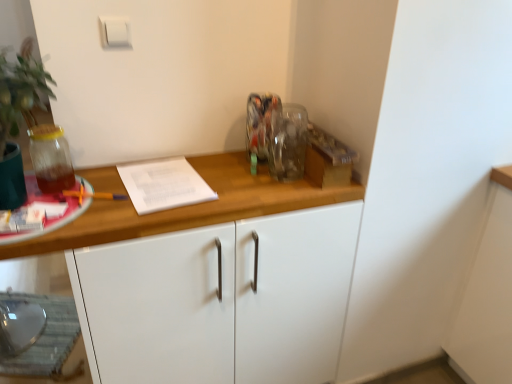
Where is `white plastic light switch at upper center`? The width and height of the screenshot is (512, 384). white plastic light switch at upper center is located at coordinates (115, 32).

Identify the location of white plastic light switch at upper center. [x=115, y=32].

Which is nearer, (125,22) or (54,160)?

The point (54,160) is in front.

Is white plastic light switch at upper center wider than translucent glass jar at left?

In fact, white plastic light switch at upper center might be narrower than translucent glass jar at left.

How different are the orientations of white plastic light switch at upper center and translucent glass jar at left in degrees?

white plastic light switch at upper center and translucent glass jar at left are facing 3.45 degrees away from each other.

Is translucent glass jar at left taller than white plastic light switch at upper center?

Yes, translucent glass jar at left is taller than white plastic light switch at upper center.

Which object is wider, translucent glass jar at left or white plastic light switch at upper center?

translucent glass jar at left is wider.

Choose the correct answer: Is translucent glass jar at left inside white plastic light switch at upper center or outside it?

translucent glass jar at left is located beyond the bounds of white plastic light switch at upper center.

Is translucent glass jar at left facing away from white plastic light switch at upper center?

No, white plastic light switch at upper center is not at the back of translucent glass jar at left.

Is the surface of white plastic light switch at upper center in direct contact with white matte cabinet at center?

They are not placed beside each other.

Is white plastic light switch at upper center positioned with its back to white matte cabinet at center?

No, white plastic light switch at upper center is not facing away from white matte cabinet at center.

How different are the orientations of white plastic light switch at upper center and white matte cabinet at center in degrees?

white plastic light switch at upper center and white matte cabinet at center are facing 0.531 degrees away from each other.

From a real-world perspective, who is located higher, white plastic light switch at upper center or white matte cabinet at center?

In real-world perspective, white plastic light switch at upper center is above.

Which object is more forward, translucent glass jar at left or white matte cabinet at center?

white matte cabinet at center is more forward.

From a real-world perspective, who is located lower, translucent glass jar at left or white matte cabinet at center?

white matte cabinet at center, from a real-world perspective.

Who is taller, translucent glass jar at left or white matte cabinet at center?

white matte cabinet at center is taller.

Does translucent glass jar at left appear on the left side of white matte cabinet at center?

Correct, you'll find translucent glass jar at left to the left of white matte cabinet at center.

Is white matte cabinet at center placed right next to translucent glass jar at left?

No, white matte cabinet at center is not in contact with translucent glass jar at left.

Does white matte cabinet at center have a greater height compared to translucent glass jar at left?

Yes, white matte cabinet at center is taller than translucent glass jar at left.

Is point (146, 268) closer to viewer compared to point (44, 160)?

Yes, it is in front of point (44, 160).

From a real-world perspective, which object stands above the other?

white plastic light switch at upper center, from a real-world perspective.

Is white matte cabinet at center aimed at white plastic light switch at upper center?

No, white matte cabinet at center is not turned towards white plastic light switch at upper center.

Would you consider white matte cabinet at center to be distant from white plastic light switch at upper center?

Actually, white matte cabinet at center and white plastic light switch at upper center are a little close together.

Find the location of `light switch behind the translucent glass jar at left`. light switch behind the translucent glass jar at left is located at coordinates (115, 32).

This screenshot has height=384, width=512. What are the coordinates of `light switch that is on the right side of translucent glass jar at left` in the screenshot? It's located at (115, 32).

Estimate the real-world distances between objects in this image. Which object is further from white matte cabinet at center, white plastic light switch at upper center or translucent glass jar at left?

white plastic light switch at upper center lies further to white matte cabinet at center than the other object.

Looking at the image, which one is located closer to white plastic light switch at upper center, translucent glass jar at left or white matte cabinet at center?

The object closer to white plastic light switch at upper center is translucent glass jar at left.

Looking at the image, which one is located closer to white matte cabinet at center, translucent glass jar at left or white plastic light switch at upper center?

translucent glass jar at left is positioned closer to the anchor white matte cabinet at center.

From the image, which object appears to be farther from translucent glass jar at left, white matte cabinet at center or white plastic light switch at upper center?

The object further to translucent glass jar at left is white matte cabinet at center.

Based on their spatial positions, is white plastic light switch at upper center or white matte cabinet at center further from translucent glass jar at left?

Based on the image, white matte cabinet at center appears to be further to translucent glass jar at left.

From the image, which object appears to be farther from white plastic light switch at upper center, white matte cabinet at center or translucent glass jar at left?

white matte cabinet at center is positioned further to the anchor white plastic light switch at upper center.

Locate an element on the screen. glass jar between white plastic light switch at upper center and white matte cabinet at center in the vertical direction is located at coordinates (51, 158).